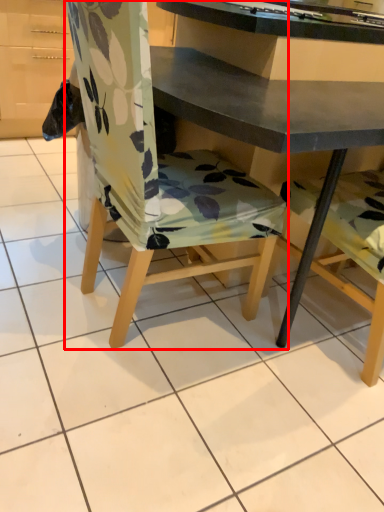
Question: Considering the relative positions of chair (annotated by the red box) and desk in the image provided, where is chair (annotated by the red box) located with respect to the staircase?

Choices:
 (A) right
 (B) left

Answer: (B)